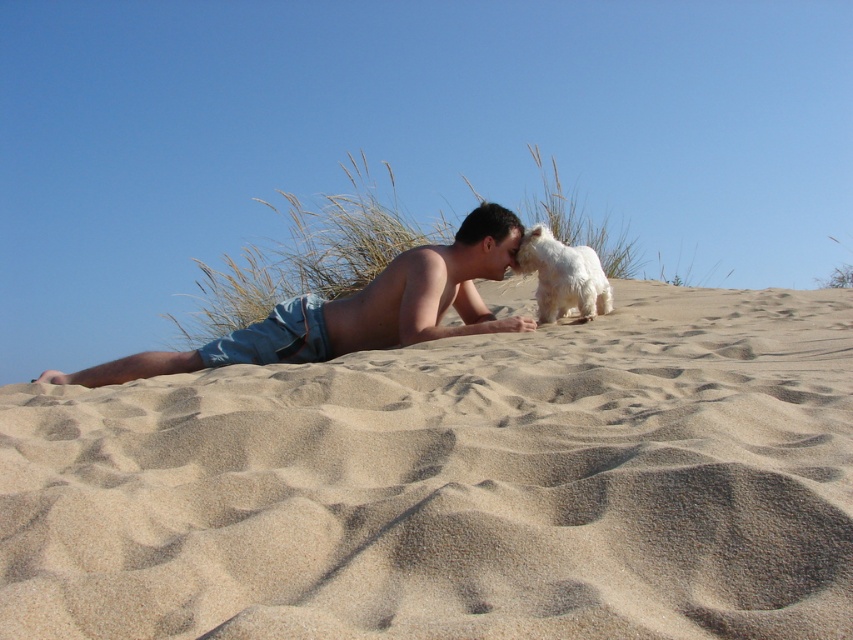
Question: In this image, where is light blue denim shorts at center located relative to white fluffy dog at upper center?

Choices:
 (A) left
 (B) right

Answer: (A)

Question: Among these points, which one is nearest to the camera?

Choices:
 (A) (134, 378)
 (B) (543, 228)

Answer: (A)

Question: Can you confirm if light beige sand at center is positioned below light blue denim shorts at center?

Choices:
 (A) yes
 (B) no

Answer: (A)

Question: Which is farther from the light beige sand at center?

Choices:
 (A) light blue denim shorts at center
 (B) white fluffy dog at upper center

Answer: (B)

Question: Considering the real-world distances, which object is closest to the white fluffy dog at upper center?

Choices:
 (A) light beige sand at center
 (B) light blue denim shorts at center

Answer: (B)

Question: Can you confirm if light beige sand at center is positioned to the left of light blue denim shorts at center?

Choices:
 (A) yes
 (B) no

Answer: (B)